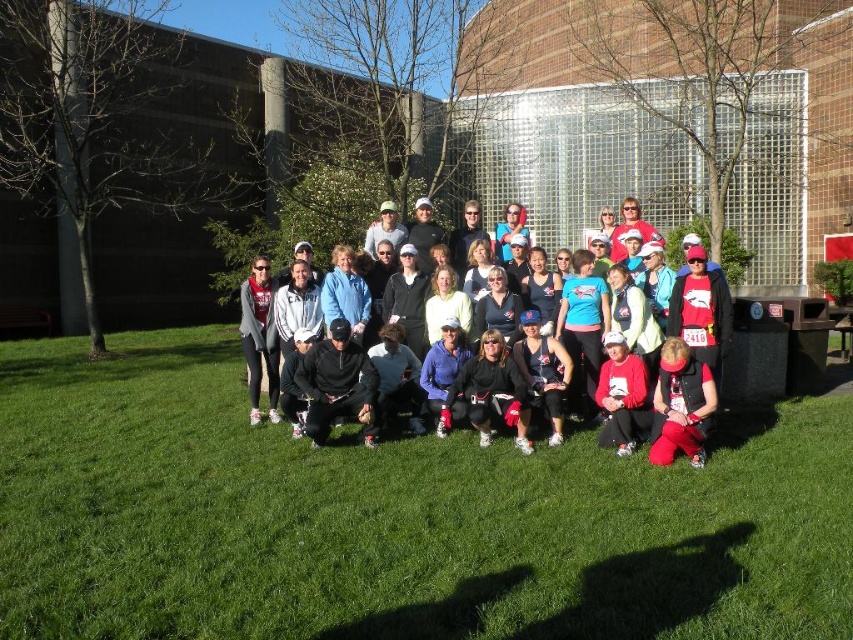
Question: Is black matte jacket at center thinner than matte black vest at lower right?

Choices:
 (A) no
 (B) yes

Answer: (A)

Question: Which object appears closest to the camera in this image?

Choices:
 (A) matte black vest at lower right
 (B) green grass at center

Answer: (B)

Question: Can you confirm if green grass at center is wider than black matte jacket at center?

Choices:
 (A) yes
 (B) no

Answer: (A)

Question: In this image, where is green grass at center located relative to black matte jacket at center?

Choices:
 (A) above
 (B) below

Answer: (B)

Question: Which point is farther to the camera?

Choices:
 (A) (689, 388)
 (B) (514, 346)

Answer: (B)

Question: Considering the real-world distances, which object is farthest from the matte black vest at lower right?

Choices:
 (A) solid white shirts at center
 (B) green grass at center

Answer: (B)